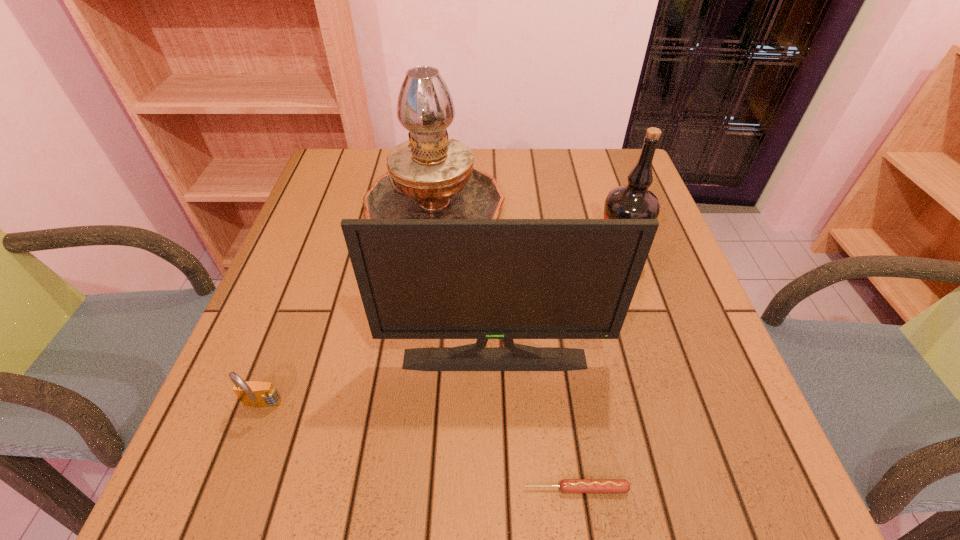
Locate an element on the screen. vacant space at the right edge of the desktop is located at coordinates (648, 308).

The width and height of the screenshot is (960, 540). In the image, there is a desktop. In order to click on blank space at the far left corner in this screenshot , I will do `click(343, 179)`.

You are a GUI agent. You are given a task and a screenshot of the screen. Output one action in this format:
    pyautogui.click(x=<x>, y=<y>)
    Task: Click on the free region at the far right corner of the desktop
    This screenshot has height=540, width=960.
    Given the screenshot: What is the action you would take?
    pyautogui.click(x=618, y=157)

In order to click on free space between the rightmost object and the sausage in this screenshot , I will do `click(596, 373)`.

I want to click on free space between the wine bottle and the nearest object, so click(x=596, y=373).

In order to click on vacant region between the monitor and the sausage in this screenshot , I will do `click(535, 424)`.

The image size is (960, 540). Find the location of `vacant area that lies between the shortest object and the fourth tallest object`. vacant area that lies between the shortest object and the fourth tallest object is located at coordinates (420, 448).

At what (x,y) coordinates should I click in order to perform the action: click on free point between the oil lamp and the leftmost object. Please return your answer as a coordinate pair (x, y). Looking at the image, I should click on (348, 309).

Select which object appears as the second closest to the oil lamp. Please provide its 2D coordinates. Your answer should be formatted as a tuple, i.e. [(x, y)], where the tuple contains the x and y coordinates of a point satisfying the conditions above.

[(482, 279)]

Point out which object is positioned as the second nearest to the padlock. Please provide its 2D coordinates. Your answer should be formatted as a tuple, i.e. [(x, y)], where the tuple contains the x and y coordinates of a point satisfying the conditions above.

[(431, 176)]